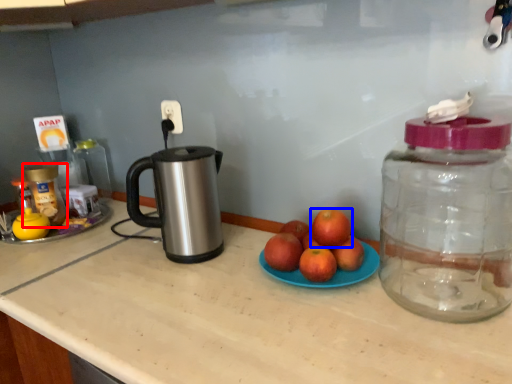
Question: Which point is closer to the camera, bottle (highlighted by a red box) or grapefruit (highlighted by a blue box)?

Choices:
 (A) bottle
 (B) grapefruit

Answer: (B)